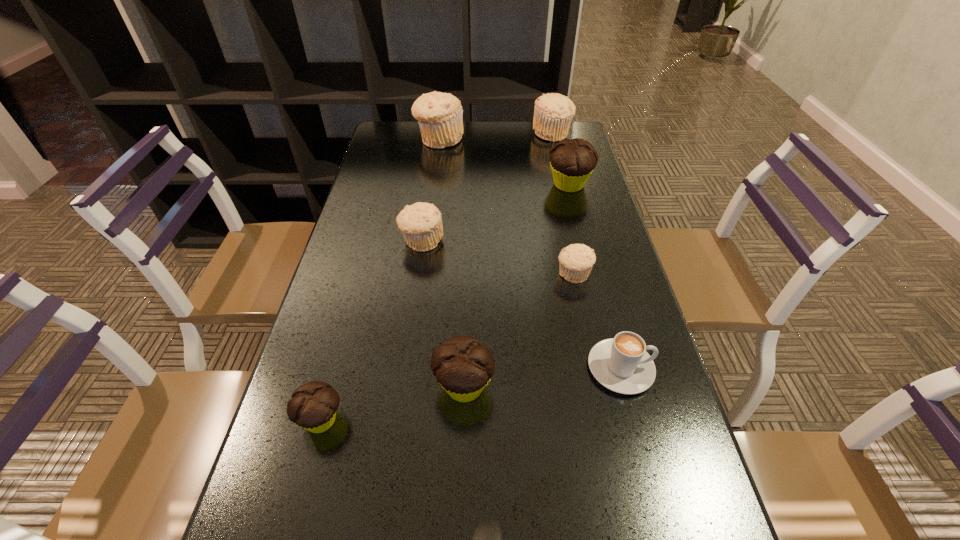
Locate an element on the screen. vacant area that lies between the rightmost chocolate muffin and the third nearest muffin is located at coordinates (571, 230).

Find the location of `vacant space that's between the biggest beige muffin and the leftmost muffin`. vacant space that's between the biggest beige muffin and the leftmost muffin is located at coordinates (380, 280).

Locate an element on the screen. The height and width of the screenshot is (540, 960). empty space between the biggest beige muffin and the cappuccino is located at coordinates (530, 254).

Locate an element on the screen. This screenshot has height=540, width=960. free space between the third biggest beige muffin and the leftmost object is located at coordinates (372, 330).

Where is `vacant area that lies between the smallest chocolate muffin and the tallest muffin`? vacant area that lies between the smallest chocolate muffin and the tallest muffin is located at coordinates (380, 280).

Find the location of `object that is the third closest to the fifth farthest object`. object that is the third closest to the fifth farthest object is located at coordinates (572, 161).

Choose which object is the third nearest neighbor to the shortest object. Please provide its 2D coordinates. Your answer should be formatted as a tuple, i.e. [(x, y)], where the tuple contains the x and y coordinates of a point satisfying the conditions above.

[(313, 407)]

Identify the location of the fifth closest muffin to the cappuccino. (x=572, y=161).

Where is `the seventh closest muffin to the cappuccino`? The height and width of the screenshot is (540, 960). the seventh closest muffin to the cappuccino is located at coordinates (553, 113).

Where is `beige muffin that is the third closest to the cappuccino`? The height and width of the screenshot is (540, 960). beige muffin that is the third closest to the cappuccino is located at coordinates (440, 116).